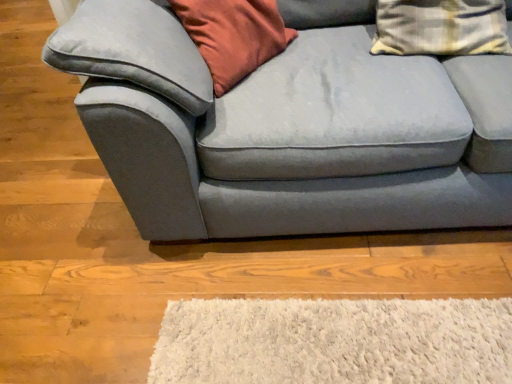
Question: Would you say plaid fabric pillow at upper right is a long distance from suede gray couch at center?

Choices:
 (A) yes
 (B) no

Answer: (B)

Question: Can you confirm if plaid fabric pillow at upper right is positioned to the left of suede gray couch at center?

Choices:
 (A) yes
 (B) no

Answer: (B)

Question: From the image's perspective, does plaid fabric pillow at upper right appear higher than suede gray couch at center?

Choices:
 (A) yes
 (B) no

Answer: (A)

Question: Can you confirm if plaid fabric pillow at upper right is bigger than suede gray couch at center?

Choices:
 (A) yes
 (B) no

Answer: (B)

Question: Could you tell me if plaid fabric pillow at upper right is turned towards suede gray couch at center?

Choices:
 (A) yes
 (B) no

Answer: (A)

Question: Does plaid fabric pillow at upper right have a greater width compared to suede gray couch at center?

Choices:
 (A) yes
 (B) no

Answer: (B)

Question: Considering the relative sizes of suede gray couch at center and plaid fabric pillow at upper right in the image provided, is suede gray couch at center smaller than plaid fabric pillow at upper right?

Choices:
 (A) yes
 (B) no

Answer: (B)

Question: Considering the relative sizes of suede gray couch at center and plaid fabric pillow at upper right in the image provided, is suede gray couch at center taller than plaid fabric pillow at upper right?

Choices:
 (A) yes
 (B) no

Answer: (A)

Question: Is plaid fabric pillow at upper right at the back of suede gray couch at center?

Choices:
 (A) no
 (B) yes

Answer: (B)

Question: Is suede gray couch at center not close to plaid fabric pillow at upper right?

Choices:
 (A) yes
 (B) no

Answer: (B)

Question: From the image's perspective, is suede gray couch at center above plaid fabric pillow at upper right?

Choices:
 (A) no
 (B) yes

Answer: (A)

Question: Is suede gray couch at center wider than plaid fabric pillow at upper right?

Choices:
 (A) yes
 (B) no

Answer: (A)

Question: In terms of height, does suede gray couch at center look taller or shorter compared to plaid fabric pillow at upper right?

Choices:
 (A) short
 (B) tall

Answer: (B)